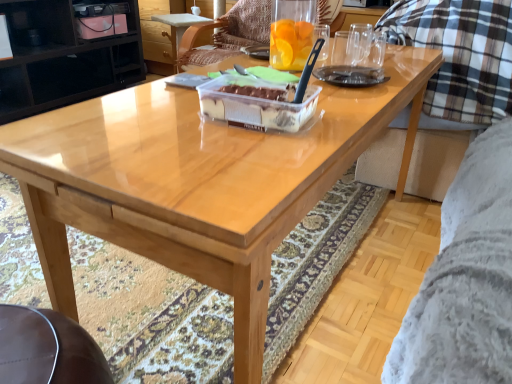
This screenshot has width=512, height=384. Describe the element at coordinates (256, 103) in the screenshot. I see `translucent plastic cake at center` at that location.

The width and height of the screenshot is (512, 384). Describe the element at coordinates (66, 54) in the screenshot. I see `black glossy cabinet at upper left` at that location.

The width and height of the screenshot is (512, 384). What do you see at coordinates (228, 34) in the screenshot?
I see `wooden chair at center` at bounding box center [228, 34].

Find the location of a particular element. This screenshot has height=384, width=512. translucent plastic cake at center is located at coordinates (256, 103).

Is wooden chair at center outside of translucent plastic cake at center?

That's correct, wooden chair at center is outside of translucent plastic cake at center.

Image resolution: width=512 pixels, height=384 pixels. What are the coordinates of `cake above the wooden chair at center (from a real-world perspective)` in the screenshot? It's located at (256, 103).

Is wooden chair at center to the left or to the right of translucent plastic cake at center in the image?

Based on their positions, wooden chair at center is located to the left of translucent plastic cake at center.

Does point (194, 29) come farther from viewer compared to point (251, 86)?

Yes.

Considering the points (287, 111) and (210, 27), which point is behind, point (287, 111) or point (210, 27)?

The point (210, 27) is behind.

Considering the relative positions of translucent plastic cake at center and wooden chair at center in the image provided, is translucent plastic cake at center to the right of wooden chair at center from the viewer's perspective?

Correct, you'll find translucent plastic cake at center to the right of wooden chair at center.

In the scene shown: Is translucent plastic cake at center located outside wooden chair at center?

That's correct, translucent plastic cake at center is outside of wooden chair at center.

Looking at this image, from a real-world perspective, is translucent plastic cake at center positioned above or below wooden chair at center?

Clearly, from a real-world perspective, translucent plastic cake at center is above wooden chair at center.

From the image's perspective, is translucent plastic cake at center beneath black glossy cabinet at upper left?

Yes.

Is point (221, 105) more distant than point (73, 26)?

No, (221, 105) is in front of (73, 26).

Can you confirm if translucent plastic cake at center is positioned to the left of black glossy cabinet at upper left?

In fact, translucent plastic cake at center is to the right of black glossy cabinet at upper left.

From the image's perspective, which one is positioned higher, wooden chair at center or black glossy cabinet at upper left?

From the image's view, black glossy cabinet at upper left is above.

Would you say wooden chair at center is outside black glossy cabinet at upper left?

Yes.

Is point (206, 57) in front of point (79, 5)?

Yes, it is.

From a real-world perspective, does black glossy cabinet at upper left stand above wooden chair at center?

No, from a real-world perspective, black glossy cabinet at upper left is not on top of wooden chair at center.

Which is behind, black glossy cabinet at upper left or wooden chair at center?

black glossy cabinet at upper left.

Considering the relative sizes of black glossy cabinet at upper left and wooden chair at center in the image provided, is black glossy cabinet at upper left taller than wooden chair at center?

Yes, black glossy cabinet at upper left is taller than wooden chair at center.

Between black glossy cabinet at upper left and translucent plastic cake at center, which one has less height?

Standing shorter between the two is translucent plastic cake at center.

Which is further, (90, 38) or (208, 97)?

The point (90, 38) is behind.

Do you think black glossy cabinet at upper left is within translucent plastic cake at center, or outside of it?

black glossy cabinet at upper left cannot be found inside translucent plastic cake at center.

You are a GUI agent. You are given a task and a screenshot of the screen. Output one action in this format:
    pyautogui.click(x=<x>, y=<y>)
    Task: Click on the chair on the left of translucent plastic cake at center
    
    Given the screenshot: What is the action you would take?
    228,34

This screenshot has height=384, width=512. In order to click on chair below the translucent plastic cake at center (from a real-world perspective) in this screenshot , I will do `click(228, 34)`.

From the picture: When comparing their distances from translucent plastic cake at center, does black glossy cabinet at upper left or wooden chair at center seem further?

black glossy cabinet at upper left.

Estimate the real-world distances between objects in this image. Which object is closer to translucent plastic cake at center, wooden chair at center or black glossy cabinet at upper left?

Among the two, wooden chair at center is located nearer to translucent plastic cake at center.

Considering their positions, is translucent plastic cake at center positioned further to black glossy cabinet at upper left than wooden chair at center?

The object further to black glossy cabinet at upper left is translucent plastic cake at center.

Based on their spatial positions, is translucent plastic cake at center or black glossy cabinet at upper left further from wooden chair at center?

Based on the image, black glossy cabinet at upper left appears to be further to wooden chair at center.

Estimate the real-world distances between objects in this image. Which object is closer to black glossy cabinet at upper left, wooden chair at center or translucent plastic cake at center?

wooden chair at center.

From the image, which object appears to be farther from wooden chair at center, black glossy cabinet at upper left or translucent plastic cake at center?

Based on the image, black glossy cabinet at upper left appears to be further to wooden chair at center.

Image resolution: width=512 pixels, height=384 pixels. I want to click on chair between black glossy cabinet at upper left and translucent plastic cake at center, so (x=228, y=34).